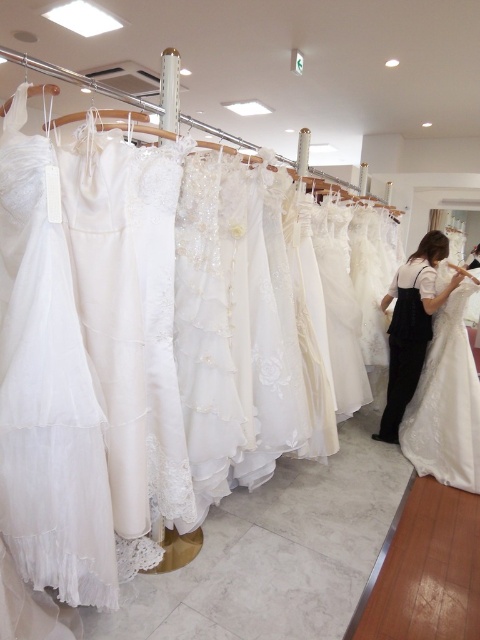
What are the coordinates of the satin white gown at right?

The satin white gown at right is located at coordinates point [445,401].

You are a customer in the bridal shop looking at the rack of wedding dresses. You want to see the white satin dress at center better. Is the satin white gown at right blocking your view of it?

The satin white gown at right is in front of the white satin dress at center, so yes, it is blocking your view of the white satin dress at center.